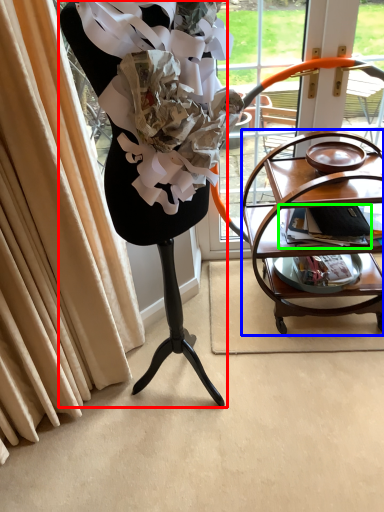
Question: Based on their relative distances, which object is farther from furniture (highlighted by a red box)? Choose from table (highlighted by a blue box) and magazine (highlighted by a green box).

Choices:
 (A) table
 (B) magazine

Answer: (B)